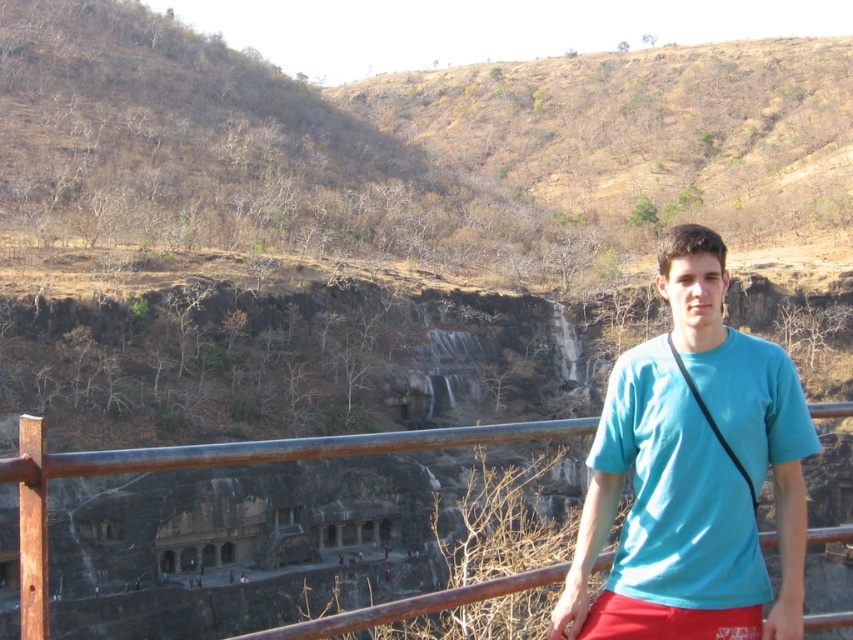
Which is more to the left, rusty metal fence at center or red cotton shorts at lower right?

rusty metal fence at center

Who is more forward, (175,464) or (636,628)?

Positioned in front is point (175,464).

Between point (840, 417) and point (613, 600), which one is positioned behind?

Positioned behind is point (840, 417).

Where is `rusty metal fence at center`? The height and width of the screenshot is (640, 853). rusty metal fence at center is located at coordinates (204, 467).

Between teal matte shirt at center and rusty metal fence at center, which one has less height?

With less height is teal matte shirt at center.

Can you confirm if teal matte shirt at center is shorter than rusty metal fence at center?

Yes, teal matte shirt at center is shorter than rusty metal fence at center.

Is point (631, 358) positioned after point (315, 449)?

Yes, point (631, 358) is behind point (315, 449).

Where is `teal matte shirt at center`? This screenshot has height=640, width=853. teal matte shirt at center is located at coordinates (693, 474).

Can you confirm if teal matte shirt at center is positioned above red cotton shorts at lower right?

Yes, teal matte shirt at center is above red cotton shorts at lower right.

Which is above, teal matte shirt at center or red cotton shorts at lower right?

teal matte shirt at center is higher up.

Who is more distant from viewer, [630,630] or [729,618]?

Point [630,630]

Where is `teal matte shirt at center`? teal matte shirt at center is located at coordinates (693, 474).